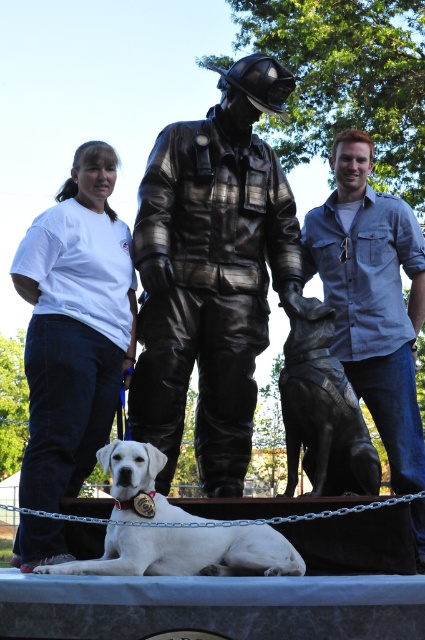
You are standing at the point marked by coordinates point (x=189, y=552). Looking around, you see the statue of a firefighter and his dog and a white Labrador Retriever lying down. Which direction should you face to look at the statue of a firefighter and his dog?

The point (x=189, y=552) corresponds to the white fur dog at lower center. To look at the statue of a firefighter and his dog, you should face towards the statue which is located above the white Labrador Retriever since the statue is positioned behind the dog in the scene.

You are a photographer trying to capture a group photo of the bronze statue of firefighter at center and the white cotton shirt at left. The camera you are using has a maximum focus range of 3 meters. Will you be able to include both subjects in the same frame without moving either of them?

The bronze statue of firefighter at center and the white cotton shirt at left are 3.28 meters apart from each other. Since the distance between them exceeds the camera maximum focus range of 3 meters, you will not be able to include both subjects in the same frame without moving them.

You are standing in front of the statue and want to take a photo of the bronze statue of firefighter at center and the white cotton shirt at left. Which object should you focus on first to ensure it appears sharp in the photo?

You should focus on the bronze statue of firefighter at center first because it is closer to you than the white cotton shirt at left, so it will be in focus before the background.